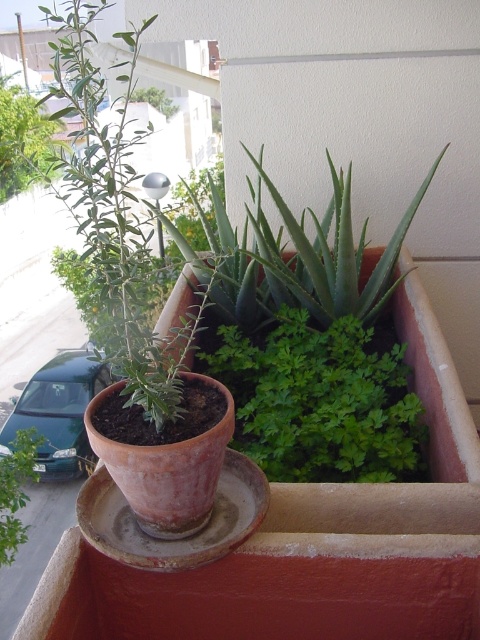
Question: Among these points, which one is nearest to the camera?

Choices:
 (A) (7, 141)
 (B) (4, 515)

Answer: (B)

Question: Can you confirm if green leafy plant at center is smaller than green leafy plant at upper left?

Choices:
 (A) no
 (B) yes

Answer: (B)

Question: Which point is farther from the camera taking this photo?

Choices:
 (A) (336, 458)
 (B) (132, 234)

Answer: (A)

Question: Is green matte plant at center below green leafy plant at left?

Choices:
 (A) yes
 (B) no

Answer: (B)

Question: Estimate the real-world distances between objects in this image. Which object is closer to the green leafy plant at upper left?

Choices:
 (A) green leafy plant at center
 (B) green leafy plant at left
 (C) green matte plant at center

Answer: (C)

Question: Can you confirm if green leafy plant at upper left is bigger than green leafy plant at left?

Choices:
 (A) yes
 (B) no

Answer: (A)